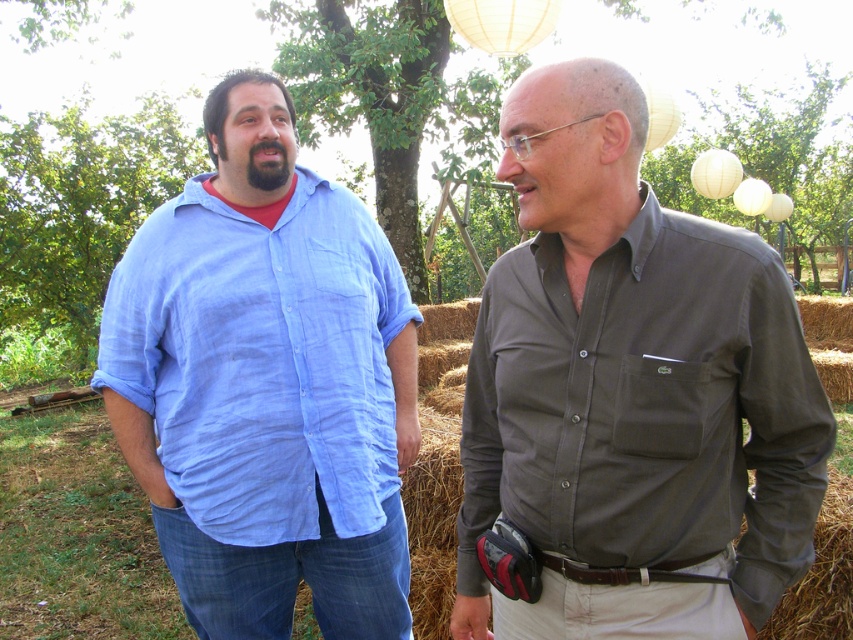
You are a photographer trying to capture both the matte olive green shirt at center and the matte blue shirt at left in a single frame. Based on their sizes in the image, which one should you focus on to ensure both are clearly visible?

The matte olive green shirt at center occupies less space than the matte blue shirt at left, so focusing on the matte blue shirt at left would allow both to be clearly visible as it is larger and easier to frame.

You are standing in a garden and see the matte olive green shirt at center. If you want to take a photo of it from where you are standing, will you need to move closer or farther away to ensure it fits entirely within your camera frame?

The matte olive green shirt at center is 4.59 feet away from you. Since the shirt is at center, you need to move closer to ensure it fits entirely within your camera frame.

What color is the object located at the coordinates point [631,388]?

The point [631,388] corresponds to the matte olive green shirt at center.